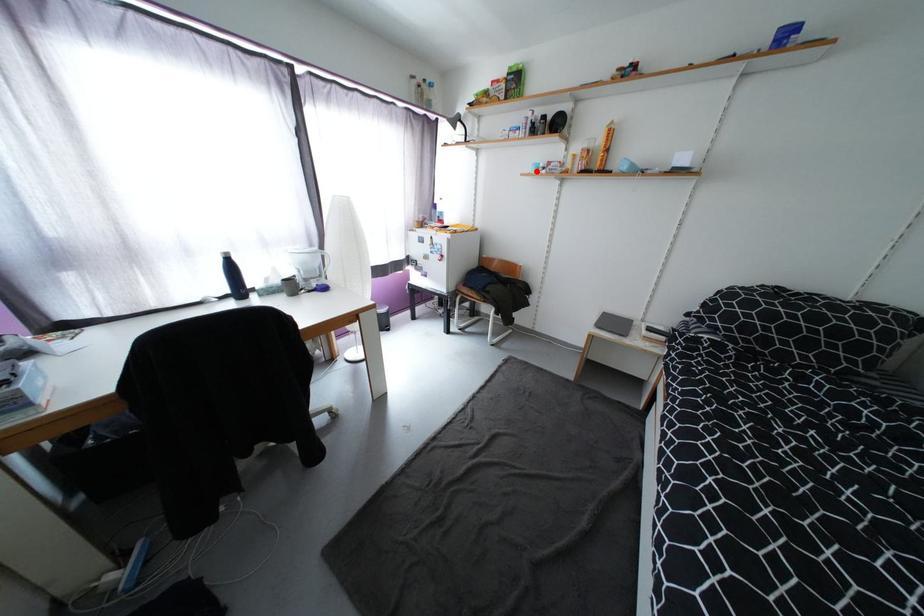
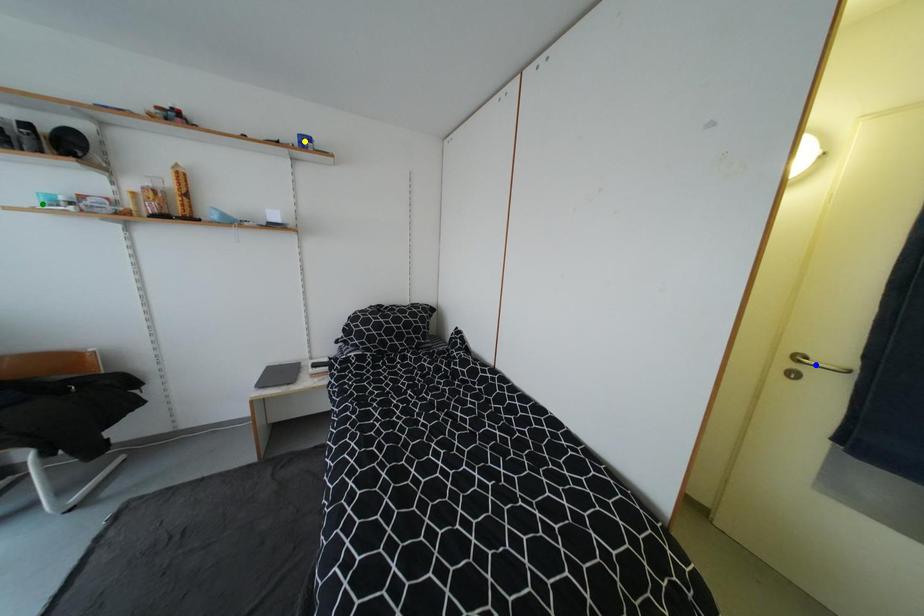
Question: I am providing you with two images of the same scene from different viewpoints. A red point is marked on the first image. You are given multiple points on the second image. Which point in image 2 represents the same 3d spot as the red point in image 1?

Choices:
 (A) green point
 (B) yellow point
 (C) blue point

Answer: (A)